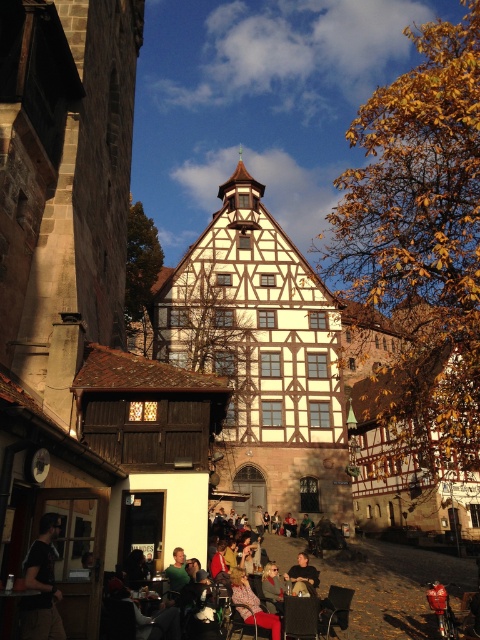
You are a pedestrian walking through the historic town and see two jackets hanging on a rack. The dark gray fabric jacket at lower left and the matte black jacket at center. Which jacket is covering the other one?

The dark gray fabric jacket at lower left is positioned over the matte black jacket at center, so it is covering the matte black jacket at center.

You are standing at the center of the historic town square, looking around. You see a dark gray fabric jacket at lower left. Where exactly is the dark gray fabric jacket located in relation to your position?

The dark gray fabric jacket at lower left is located at coordinates point (41,584) relative to your position.

You are a tailor observing two jackets in the scene. The dark gray fabric jacket at lower left and the matte black jacket at center. Which jacket is shorter in height?

The dark gray fabric jacket at lower left has a lesser height compared to matte black jacket at center, so the dark gray fabric jacket at lower left is shorter in height.